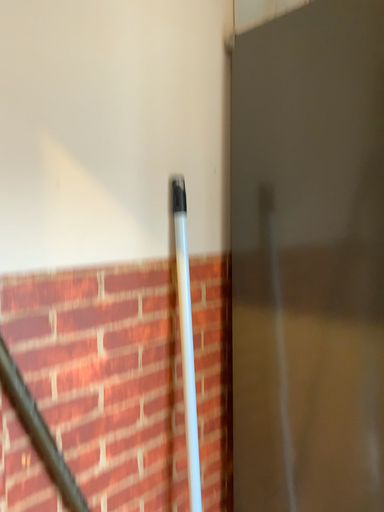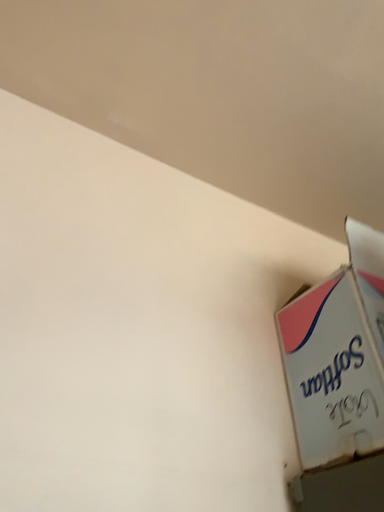
Question: Which way did the camera rotate in the video?

Choices:
 (A) rotated upward
 (B) rotated downward

Answer: (A)